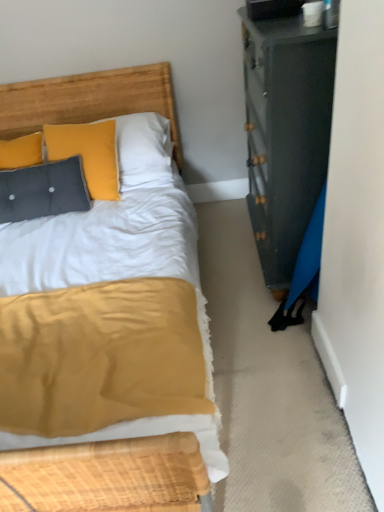
The height and width of the screenshot is (512, 384). What do you see at coordinates (90, 100) in the screenshot?
I see `wooden headboard at upper left` at bounding box center [90, 100].

Measure the distance between point [44,87] and camera.

Point [44,87] and camera are 8.35 feet apart.

The height and width of the screenshot is (512, 384). Identify the location of wooden headboard at upper left. (90, 100).

Consider the image. Measure the distance between point (63, 208) and camera.

A distance of 7.29 feet exists between point (63, 208) and camera.

Find the location of `textured gray pillow at upper left`. textured gray pillow at upper left is located at coordinates (43, 190).

What do you see at coordinates (43, 190) in the screenshot?
I see `textured gray pillow at upper left` at bounding box center [43, 190].

The height and width of the screenshot is (512, 384). What are the coordinates of `wooden headboard at upper left` in the screenshot? It's located at (90, 100).

Which is more to the left, wooden headboard at upper left or textured gray pillow at upper left?

Positioned to the left is textured gray pillow at upper left.

Is wooden headboard at upper left in front of or behind textured gray pillow at upper left in the image?

In the image, wooden headboard at upper left appears in front of textured gray pillow at upper left.

Considering the points (54, 113) and (53, 175), which point is behind, point (54, 113) or point (53, 175)?

Positioned behind is point (54, 113).

From the image's perspective, would you say wooden headboard at upper left is shown under textured gray pillow at upper left?

No, from the image's perspective, wooden headboard at upper left is not below textured gray pillow at upper left.

From a real-world perspective, is wooden headboard at upper left positioned above or below textured gray pillow at upper left?

wooden headboard at upper left is situated higher than textured gray pillow at upper left in the real world.

Considering the relative sizes of wooden headboard at upper left and textured gray pillow at upper left in the image provided, is wooden headboard at upper left thinner than textured gray pillow at upper left?

Yes.

Considering the sizes of objects wooden headboard at upper left and textured gray pillow at upper left in the image provided, who is taller, wooden headboard at upper left or textured gray pillow at upper left?

wooden headboard at upper left.

Which of these two, wooden headboard at upper left or textured gray pillow at upper left, is smaller?

Smaller between the two is textured gray pillow at upper left.

Can textured gray pillow at upper left be found inside wooden headboard at upper left?

No, textured gray pillow at upper left is located outside of wooden headboard at upper left.

Is wooden headboard at upper left far away from textured gray pillow at upper left?

No.

Is textured gray pillow at upper left at the back of wooden headboard at upper left?

No, wooden headboard at upper left's orientation is not away from textured gray pillow at upper left.

Locate an element on the screen. The height and width of the screenshot is (512, 384). headboard to the right of textured gray pillow at upper left is located at coordinates (90, 100).

Considering the positions of objects textured gray pillow at upper left and wooden headboard at upper left in the image provided, who is more to the right, textured gray pillow at upper left or wooden headboard at upper left?

Positioned to the right is wooden headboard at upper left.

In the scene shown: Is textured gray pillow at upper left further to camera compared to wooden headboard at upper left?

Yes, textured gray pillow at upper left is behind wooden headboard at upper left.

Is point (14, 208) less distant than point (58, 79)?

That is True.

From the image's perspective, which one is positioned higher, textured gray pillow at upper left or wooden headboard at upper left?

From the image's view, wooden headboard at upper left is above.

From a real-world perspective, relative to wooden headboard at upper left, is textured gray pillow at upper left vertically above or below?

Clearly, from a real-world perspective, textured gray pillow at upper left is below wooden headboard at upper left.

Looking at their sizes, would you say textured gray pillow at upper left is wider or thinner than wooden headboard at upper left?

Considering their sizes, textured gray pillow at upper left looks broader than wooden headboard at upper left.

Considering the relative sizes of textured gray pillow at upper left and wooden headboard at upper left in the image provided, is textured gray pillow at upper left taller than wooden headboard at upper left?

No, textured gray pillow at upper left is not taller than wooden headboard at upper left.

Can you confirm if textured gray pillow at upper left is smaller than wooden headboard at upper left?

Yes, textured gray pillow at upper left is smaller than wooden headboard at upper left.

Would you say textured gray pillow at upper left is inside or outside wooden headboard at upper left?

textured gray pillow at upper left cannot be found inside wooden headboard at upper left.

Consider the image. Is textured gray pillow at upper left next to wooden headboard at upper left and touching it?

No, textured gray pillow at upper left is not with wooden headboard at upper left.

From the picture: Could you tell me if textured gray pillow at upper left is turned towards wooden headboard at upper left?

No, textured gray pillow at upper left is not aimed at wooden headboard at upper left.

Can you tell me how much textured gray pillow at upper left and wooden headboard at upper left differ in facing direction?

The facing directions of textured gray pillow at upper left and wooden headboard at upper left are 5.61 degrees apart.

At what (x,y) coordinates should I click in order to perform the action: click on pillow below the wooden headboard at upper left (from the image's perspective). Please return your answer as a coordinate pair (x, y). The height and width of the screenshot is (512, 384). Looking at the image, I should click on coord(43,190).

Where is `pillow below the wooden headboard at upper left (from a real-world perspective)`? pillow below the wooden headboard at upper left (from a real-world perspective) is located at coordinates (43, 190).

Identify the location of pillow to the left of wooden headboard at upper left. The height and width of the screenshot is (512, 384). (43, 190).